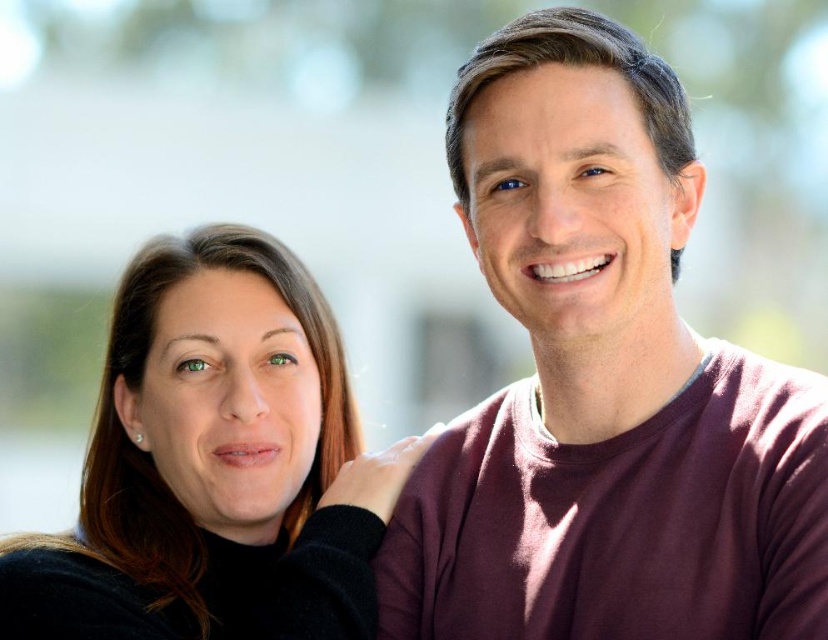
You are trying to decide which sweater to wear today. You see the maroon sweater at upper right and the matte black sweater at left in the image. Which one has a larger size?

The maroon sweater at upper right is bigger than the matte black sweater at left, so it has a larger size.

You are trying to decide which sweater to wear today. You see the maroon sweater at upper right and the matte black sweater at left. Which one is positioned to the right of the other?

The maroon sweater at upper right is to the right of the matte black sweater at left.